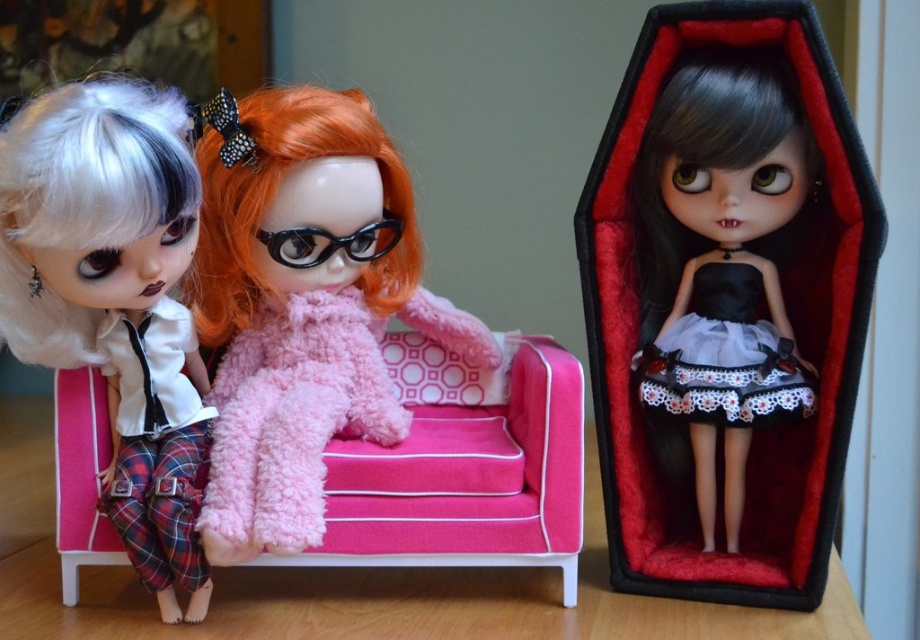
In the scene with the three dolls, the black satin doll at center and the black glossy glasses at center are both present. Which object is positioned to the right of the other?

The black satin doll at center is positioned to the right of the black glossy glasses at center.

You are a toy collector examining the dolls and their arrangement. You want to place a new accessory between the black satin doll at center and the fuzzy pink dress at center. Which doll should the accessory be closer to in order to maintain the spatial relationship shown in the image?

The black satin doll at center is closer to the viewer than the fuzzy pink dress at center, so the accessory should be placed closer to the black satin doll at center to maintain the spatial relationship.

You are a photographer standing at the camera position. You want to capture a closeup shot of the middle doll. The camera can focus on objects within 35 inches. Is the point at coordinates point (826,168) within the focus range?

The distance of point (826,168) from camera is 37.23 inches, which is beyond the camera focus range of 35 inches. The photographer cannot focus on that point.